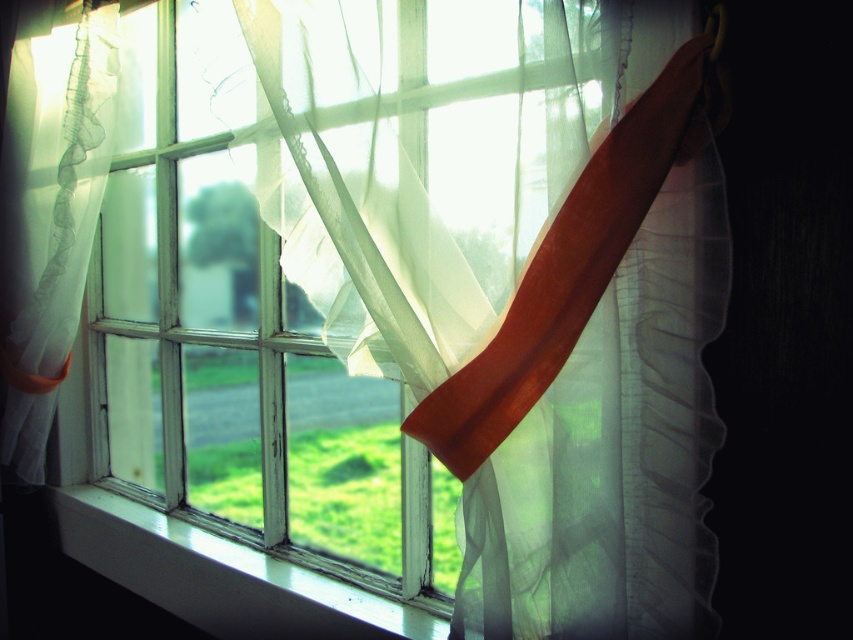
You are an interior designer assessing the window setup. Which object would allow more light to pass through, the translucent white curtain at center or the white painted wood at lower center?

The translucent white curtain at center is thinner than the white painted wood at lower center, so it allows more light to pass through.

You are a painter who wants to hang a 12 inch wide painting on the wall between the translucent white curtain at center and the white painted wood at lower center. Is there enough space for the painting?

The translucent white curtain at center is 19.10 inches from the white painted wood at lower center. Since the painting is 12 inches wide, there is enough space between them to hang it.

You are holding a 12 inch ruler and want to measure the distance from the camera to the translucent white curtain at center. Can you reach it with the ruler?

The translucent white curtain at center is 28.90 inches away from the camera. Since the ruler is 12 inches long, it is not long enough to measure the distance. You need a longer measuring tool.